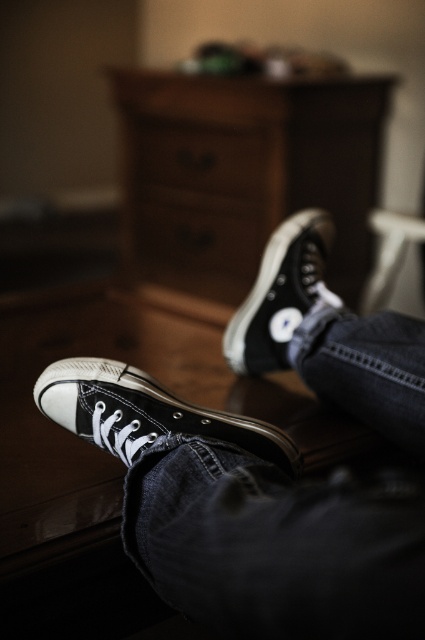
Question: Based on their relative distances, which object is farther from the white plastic stool at lower right?

Choices:
 (A) black canvas shoe at center
 (B) wooden dresser at center
 (C) brown wood drawer at center

Answer: (A)

Question: From the image, what is the correct spatial relationship of black canvas sneakers at center in relation to white plastic stool at lower right?

Choices:
 (A) above
 (B) below

Answer: (B)

Question: Which object is the farthest from the black canvas sneakers at lower center?

Choices:
 (A) wooden dresser at center
 (B) white plastic stool at lower right

Answer: (A)

Question: Which object is positioned closest to the white plastic stool at lower right?

Choices:
 (A) wooden dresser at center
 (B) black canvas shoe at center
 (C) black canvas sneakers at center
 (D) brown wood drawer at center

Answer: (A)

Question: Is black canvas sneakers at center further to camera compared to white plastic stool at lower right?

Choices:
 (A) yes
 (B) no

Answer: (B)

Question: Can you confirm if black canvas sneakers at lower center is wider than wooden dresser at center?

Choices:
 (A) no
 (B) yes

Answer: (A)